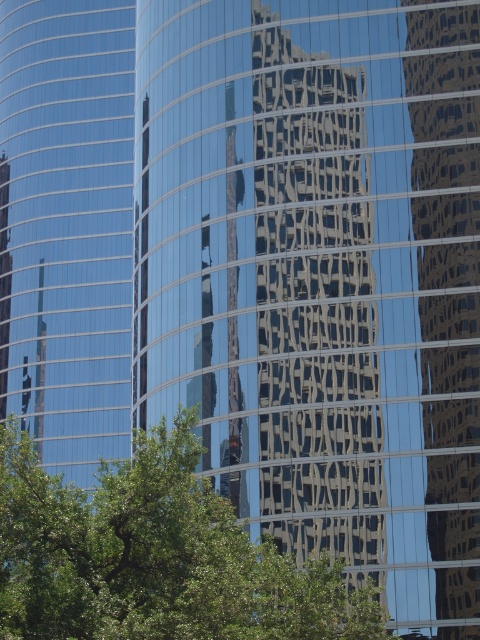
Question: Observing the image, what is the correct spatial positioning of green leafy tree at center in reference to glossy glass building at center?

Choices:
 (A) right
 (B) left

Answer: (B)

Question: Does green leafy tree at center appear over glossy glass building at center?

Choices:
 (A) no
 (B) yes

Answer: (A)

Question: Which of the following is the farthest from the observer?

Choices:
 (A) green leafy tree at center
 (B) glossy glass building at center

Answer: (B)

Question: Does green leafy tree at center have a lesser width compared to glossy glass building at center?

Choices:
 (A) no
 (B) yes

Answer: (A)

Question: Which point is farther to the camera?

Choices:
 (A) (261, 625)
 (B) (447, 428)

Answer: (B)